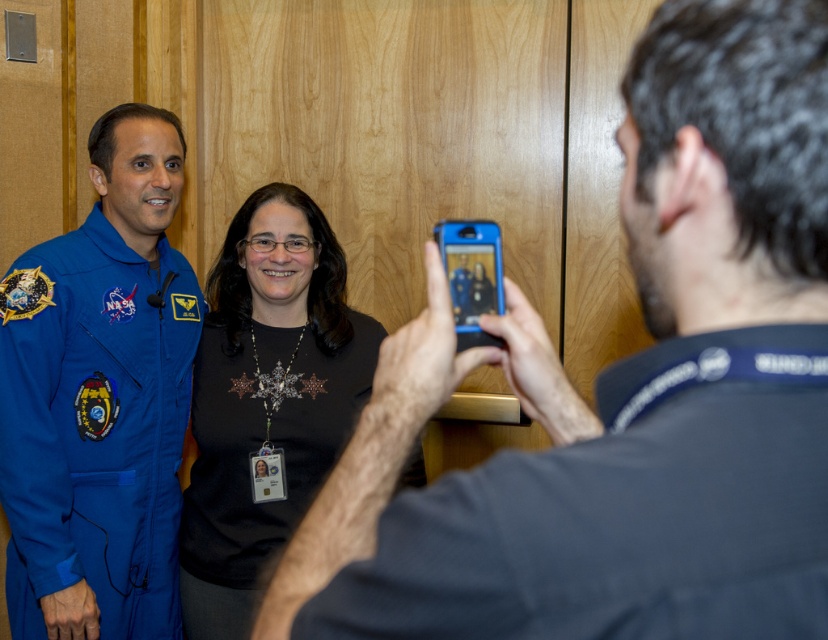
You are trying to decide which shirt to wear for a casual day out. Both the dark blue shirt at center and the black matte shirt at center are in your wardrobe. If you want to wear the taller one, which should you choose?

The dark blue shirt at center is not as tall as the black matte shirt at center, so you should choose the black matte shirt at center since it is taller.

You are standing in the room where the photograph was taken. The blue fabric astronaut suit at left is at point 0.623, 0.122. If you want to move closer to the astronaut, which direction should you move in the image?

To move closer to the blue fabric astronaut suit at left, you should move towards the left side of the image since the astronaut is positioned at the left.

You are trying to locate the dark blue shirt at center in the image. What are the coordinates where you should look?

The dark blue shirt at center is located at coordinates point (622,392).